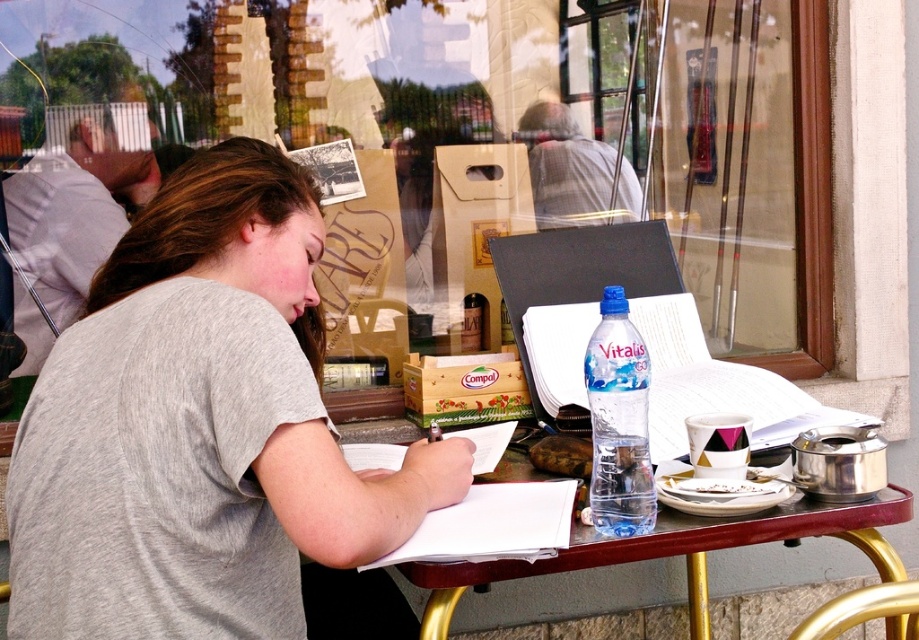
You are a photographer standing 1.5 meters away from the gray cotton shirt at center. Can you reach it without moving your feet?

The gray cotton shirt at center is only 1.03 meters away from the viewer, so yes, you can reach it without moving your feet since it is closer than your 1.5 meters distance.

You are at the outdoor cafe and want to place a new item between the gray cotton shirt at center and the clear plastic bottle at center. Which object should you place it closer to if you want the item to be near the larger object?

You should place the new item closer to the gray cotton shirt at center because it is larger than the clear plastic bottle at center.

You are standing at the entrance of the outdoor cafe. You see the wooden table at center. Can you determine its exact coordinates based on the cafe layout?

The wooden table at center is located at point (657, 545), so yes, its coordinates are known.